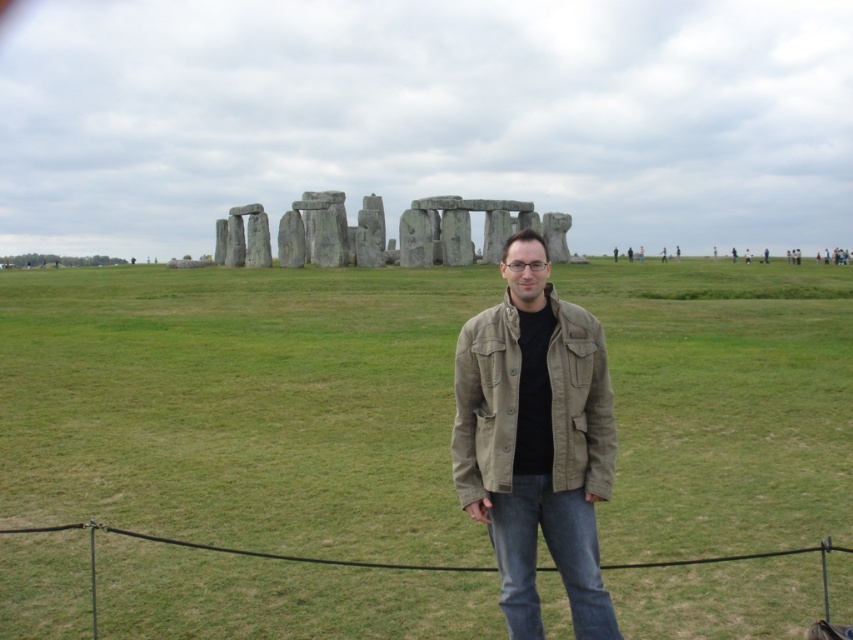
Question: Is green grassy field at center in front of khaki cotton jacket at center?

Choices:
 (A) yes
 (B) no

Answer: (B)

Question: Where is green grassy field at center located in relation to khaki cotton jacket at center in the image?

Choices:
 (A) right
 (B) left

Answer: (B)

Question: Which point is closer to the camera?

Choices:
 (A) (345, 353)
 (B) (506, 308)

Answer: (B)

Question: Can you confirm if green grassy field at center is positioned to the right of khaki cotton jacket at center?

Choices:
 (A) no
 (B) yes

Answer: (A)

Question: Which of the following is the closest to the observer?

Choices:
 (A) (483, 397)
 (B) (48, 456)

Answer: (A)

Question: Which point is farther to the camera?

Choices:
 (A) green grassy field at center
 (B) khaki cotton jacket at center

Answer: (A)